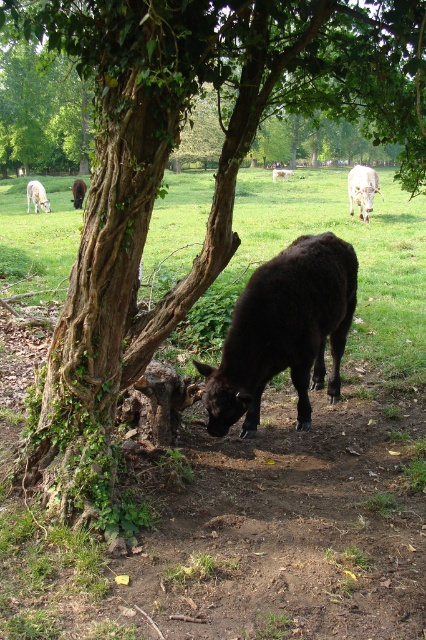
Question: Considering the relative positions of black woolly sheep at lower center and white woolly sheep at upper left in the image provided, where is black woolly sheep at lower center located with respect to white woolly sheep at upper left?

Choices:
 (A) right
 (B) left

Answer: (A)

Question: Where is white glossy cow at upper right located in relation to brown furry cow at center in the image?

Choices:
 (A) right
 (B) left

Answer: (A)

Question: Which point is closer to the camera?

Choices:
 (A) white woolly sheep at upper left
 (B) brown furry cow at center
 (C) white glossy cow at upper right
 (D) green leafy grass at center

Answer: (D)

Question: Considering the real-world distances, which object is closest to the green leafy grass at center?

Choices:
 (A) brown furry cow at center
 (B) black woolly sheep at lower center

Answer: (B)

Question: Where is black woolly sheep at lower center located in relation to brown furry cow at center in the image?

Choices:
 (A) right
 (B) left

Answer: (B)

Question: Which is farther from the white glossy cow at upper right?

Choices:
 (A) black woolly sheep at lower center
 (B) white woolly sheep at upper left

Answer: (A)